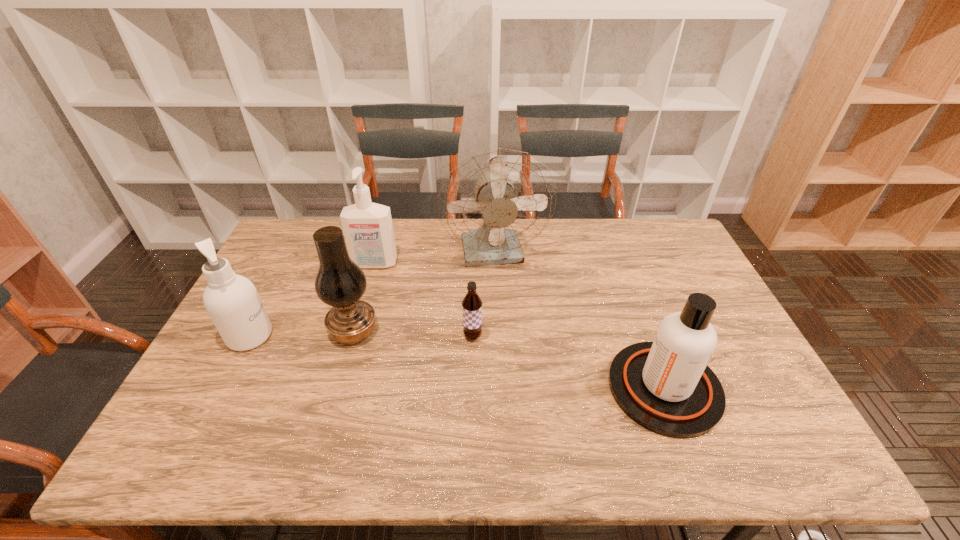
Identify the location of free location that satisfies the following two spatial constraints: 1. in front of the rightmost object to blow air; 2. on the left side of the fan. Image resolution: width=960 pixels, height=540 pixels. (501, 388).

Identify the location of free spot that satisfies the following two spatial constraints: 1. on the front label of the shortest object; 2. on the left side of the farthest cleansing agent. (354, 336).